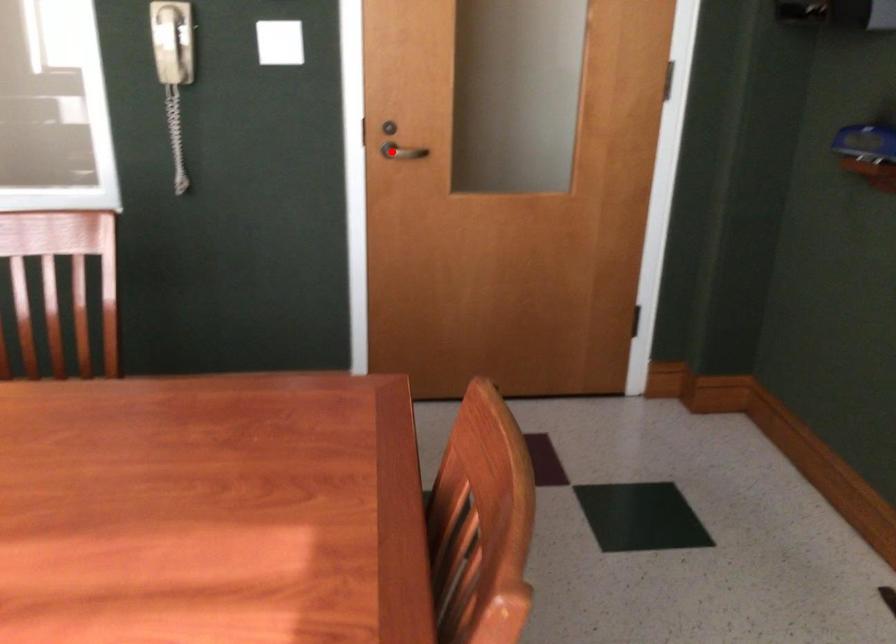
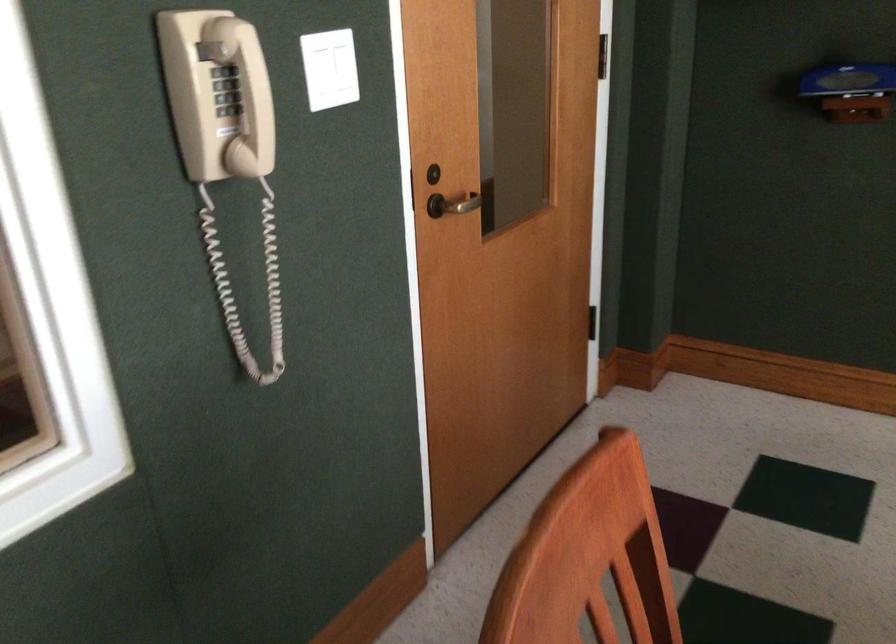
Question: I am providing you with two images of the same scene from different viewpoints. In image1, a red point is highlighted. Considering the same 3D point in image2, which of the following is correct?

Choices:
 (A) It is closer
 (B) It is farther

Answer: (A)